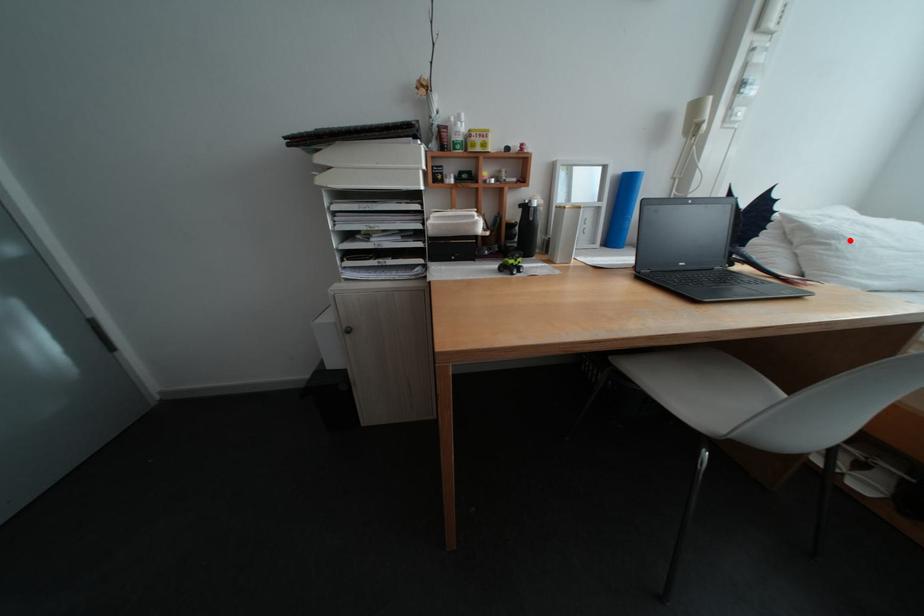
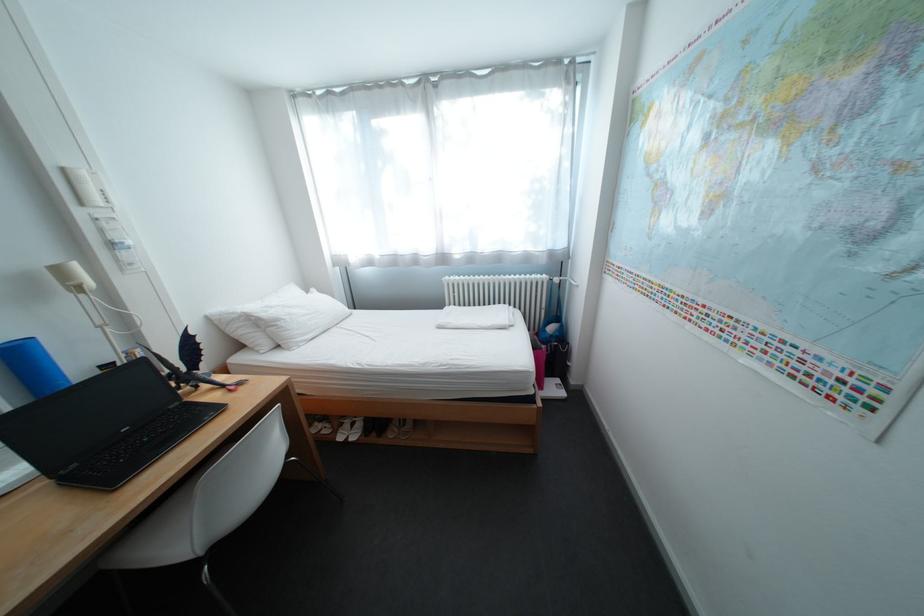
Question: I am providing you with two images of the same scene from different viewpoints. A red point is marked on the first image. At the location where the point appears in image 1, is it still visible in image 2?

Choices:
 (A) Yes
 (B) No

Answer: (A)